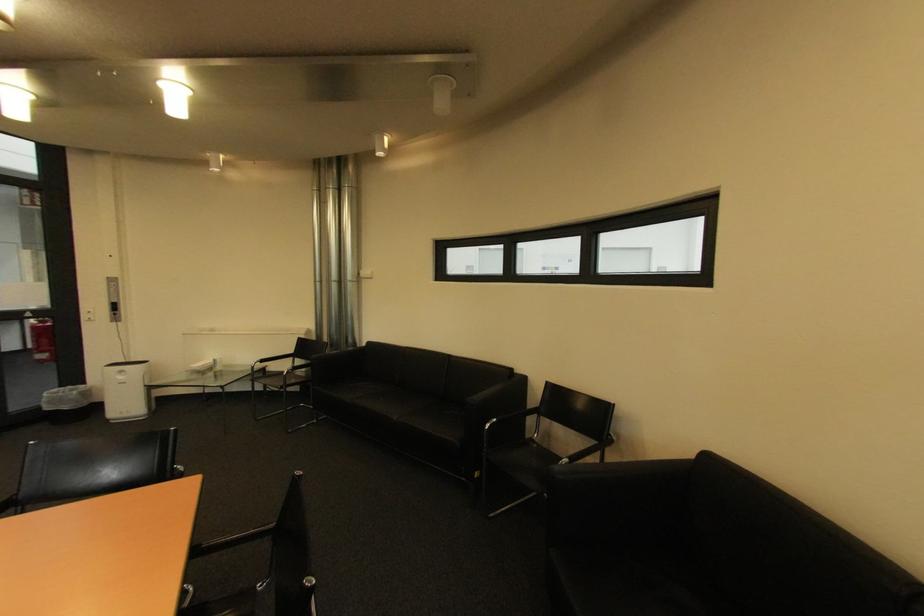
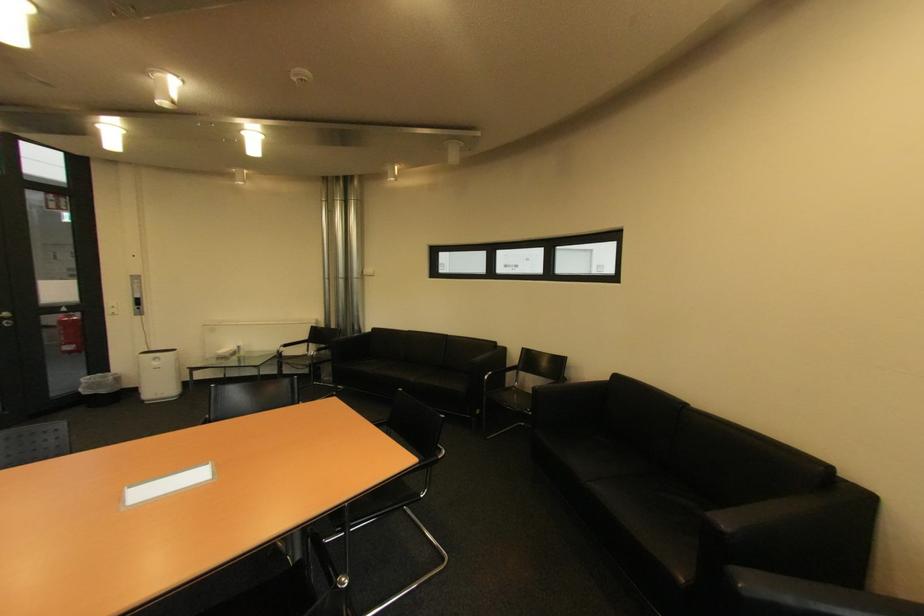
Where in the second image is the point corresponding to (x=715, y=458) from the first image?

(625, 378)